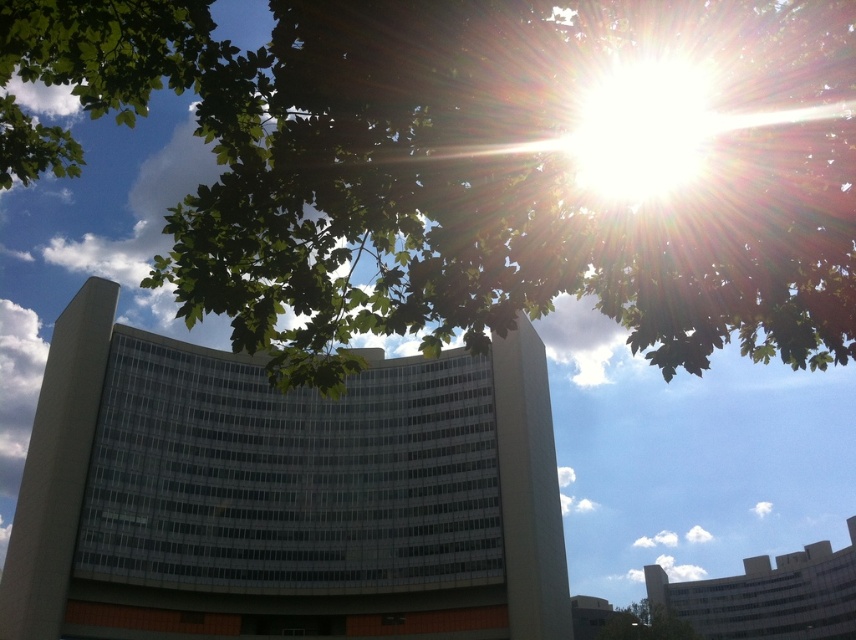
You are standing in front of the modern building and want to take a photo of the sunlit facade without any obstructions. Which tree should you move to avoid, the green leafy tree at upper center or the green leafy tree at lower right?

You should move away from the green leafy tree at upper center because it is in front of the green leafy tree at lower right and would block your view of the building facade.

Looking at this image, you are standing in front of the modern building and want to take a photo of the curved facade without any obstructions. The green leafy tree at upper center is blocking your view. Can you estimate how far to the left or right you should move to avoid the obstruction?

The green leafy tree at upper center is located at point 0.270 on the horizontal axis. To avoid the obstruction, you should move either to the left of 0.270 or to the right of 0.270 along the horizontal axis to ensure the tree is no longer in front of the building facade.